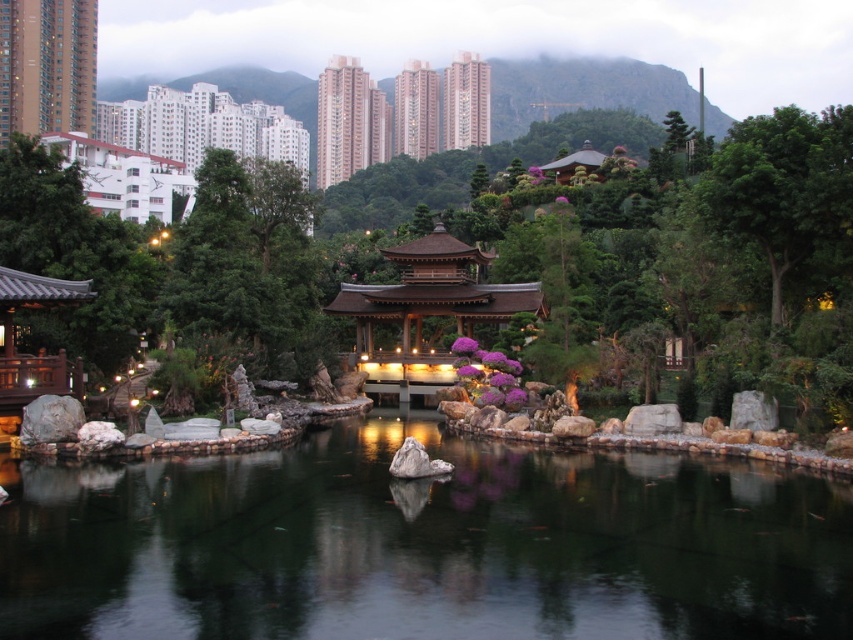
Can you confirm if pink concrete temple at upper center is shorter than matte brown temple at upper left?

No.

Between pink concrete temple at upper center and matte brown temple at upper left, which one is positioned lower?

matte brown temple at upper left is below.

This screenshot has height=640, width=853. I want to click on pink concrete temple at upper center, so [372, 116].

Is green matte tree at upper left thinner than green leafy tree at upper right?

Correct, green matte tree at upper left's width is less than green leafy tree at upper right's.

Who is more forward, (50, 349) or (824, 152)?

Point (824, 152) is in front.

Locate an element on the screen. green matte tree at upper left is located at coordinates (73, 257).

Does green leafy tree at upper right have a larger size compared to matte brown temple at upper left?

Incorrect, green leafy tree at upper right is not larger than matte brown temple at upper left.

Which of these two, green leafy tree at upper right or matte brown temple at upper left, stands shorter?

With less height is green leafy tree at upper right.

What do you see at coordinates (787, 195) in the screenshot? The height and width of the screenshot is (640, 853). I see `green leafy tree at upper right` at bounding box center [787, 195].

Identify the location of green leafy tree at upper right. (787, 195).